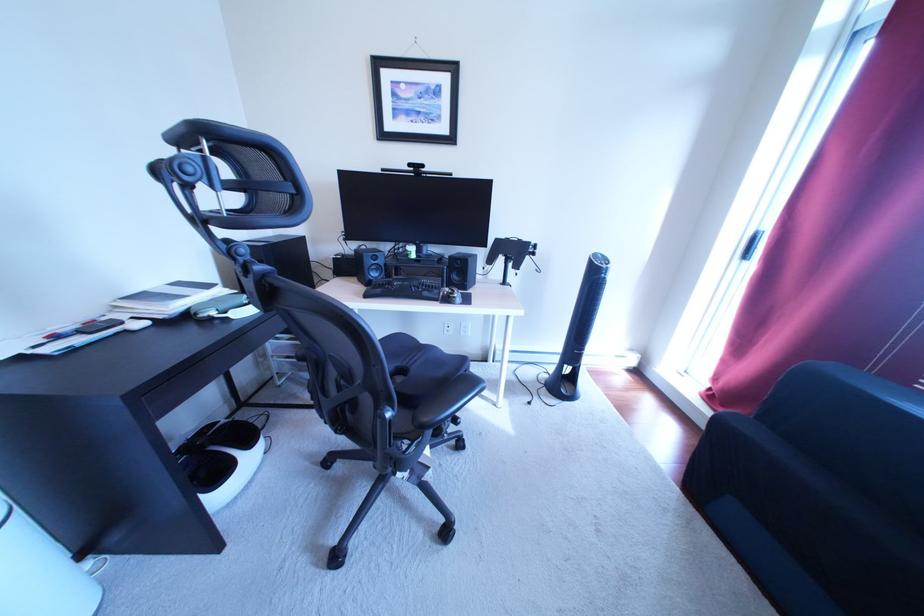
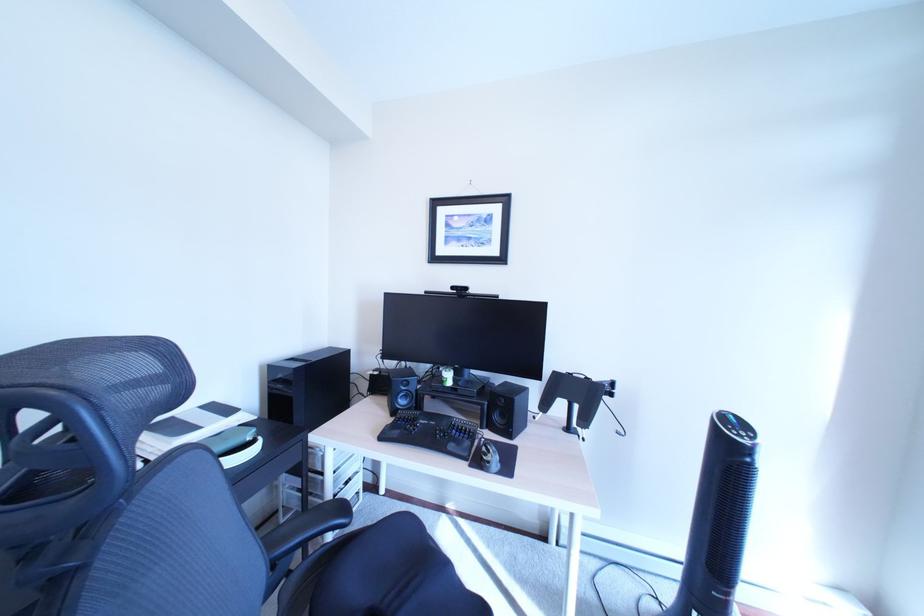
In a continuous first-person perspective shot, in which direction is the camera moving?

The movement direction of the cameraman is right, forward.